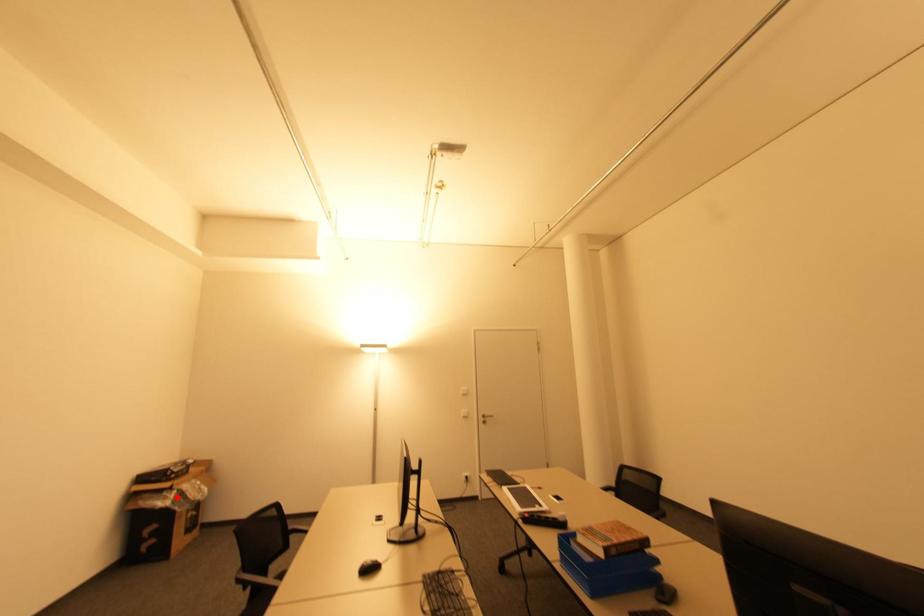
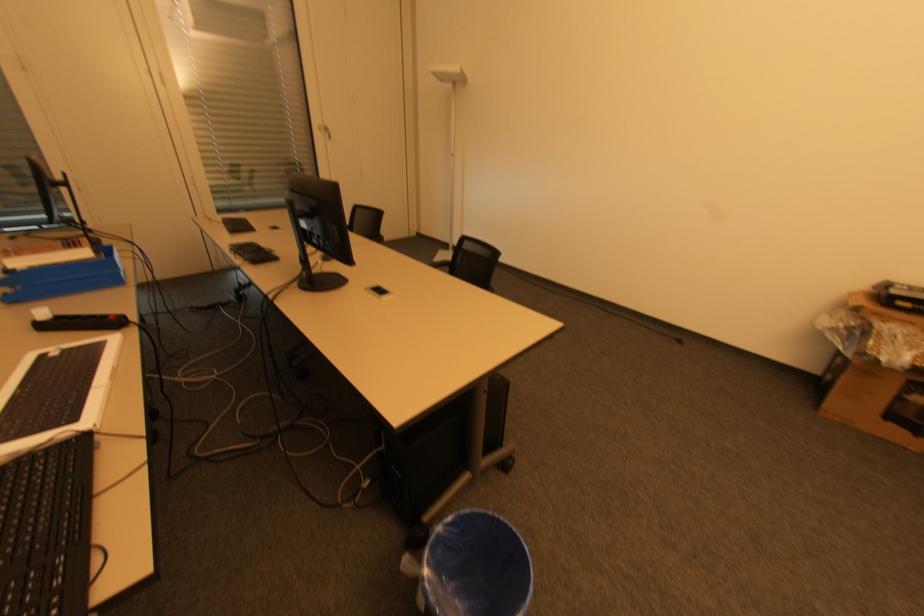
Question: A red point is marked in image1. In image2, is the corresponding 3D point closer to the camera or farther? Reply with the corresponding letter.

Choices:
 (A) The corresponding 3D point is closer.
 (B) The corresponding 3D point is farther.

Answer: (B)